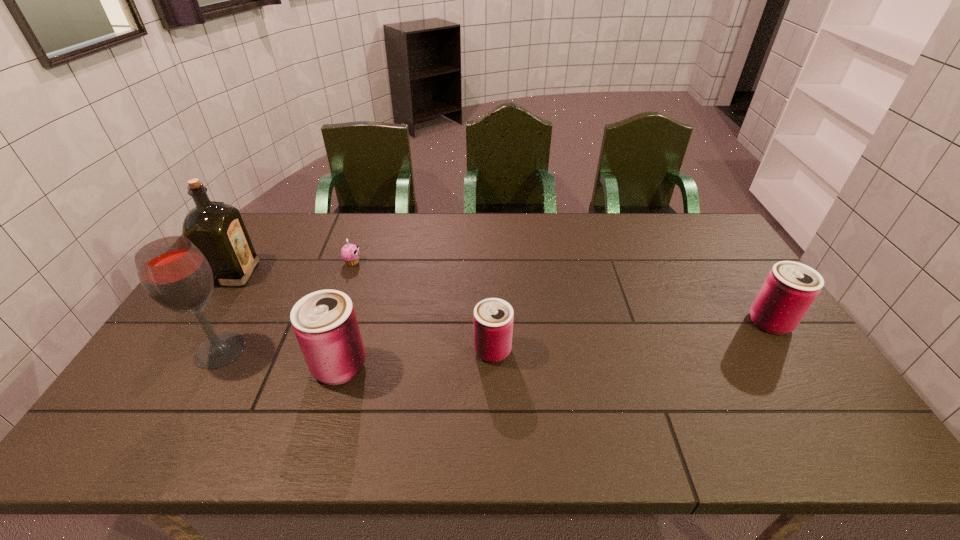
Locate an element on the screen. the leftmost can is located at coordinates (325, 324).

Identify the location of the shortest can. (493, 318).

You are a GUI agent. You are given a task and a screenshot of the screen. Output one action in this format:
    pyautogui.click(x=<x>, y=<y>)
    Task: Click on the fifth tallest object
    The width and height of the screenshot is (960, 540).
    Given the screenshot: What is the action you would take?
    pyautogui.click(x=493, y=318)

Identify the location of the rightmost can. The image size is (960, 540). tap(790, 288).

You are a GUI agent. You are given a task and a screenshot of the screen. Output one action in this format:
    pyautogui.click(x=<x>, y=<y>)
    Task: Click on the second shortest can
    
    Given the screenshot: What is the action you would take?
    pyautogui.click(x=790, y=288)

You are a GUI agent. You are given a task and a screenshot of the screen. Output one action in this format:
    pyautogui.click(x=<x>, y=<y>)
    Task: Click on the liquor
    
    Given the screenshot: What is the action you would take?
    pyautogui.click(x=217, y=229)

Locate an element on the screen. The width and height of the screenshot is (960, 540). alcohol is located at coordinates (173, 271).

At what (x,y) coordinates should I click in order to perform the action: click on the shortest object. Please return your answer as a coordinate pair (x, y). The image size is (960, 540). Looking at the image, I should click on (350, 253).

Where is `free space located on the left of the leftmost can`? This screenshot has height=540, width=960. free space located on the left of the leftmost can is located at coordinates 212,366.

The height and width of the screenshot is (540, 960). Identify the location of free space located 0.280m on the left of the second shortest object. (370, 350).